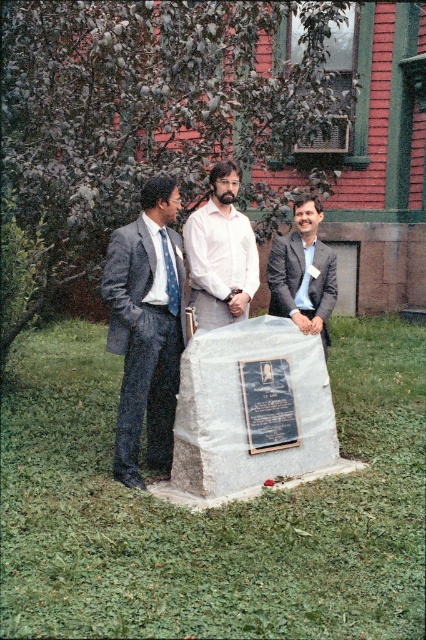
Is white cotton shirt at center positioned before blue dotted tie at center?

That is False.

Is white cotton shirt at center to the right of blue dotted tie at center from the viewer's perspective?

Indeed, white cotton shirt at center is positioned on the right side of blue dotted tie at center.

The height and width of the screenshot is (640, 426). I want to click on white cotton shirt at center, so click(x=221, y=252).

From the picture: Can you confirm if gray stone monument at center is taller than gray textured suit at left?

→ No.

Does gray stone monument at center appear on the right side of gray textured suit at left?

Correct, you'll find gray stone monument at center to the right of gray textured suit at left.

Which is behind, point (226, 364) or point (161, 196)?

The point (161, 196) is more distant.

Locate an element on the screen. gray stone monument at center is located at coordinates (252, 406).

Can you confirm if gray stone monument at center is positioned to the right of blue dotted tie at center?

Correct, you'll find gray stone monument at center to the right of blue dotted tie at center.

Between gray stone monument at center and blue dotted tie at center, which one is positioned lower?

gray stone monument at center is lower down.

Is point (290, 468) positioned behind point (169, 298)?

That is True.

The image size is (426, 640). Find the location of `gray stone monument at center`. gray stone monument at center is located at coordinates (252, 406).